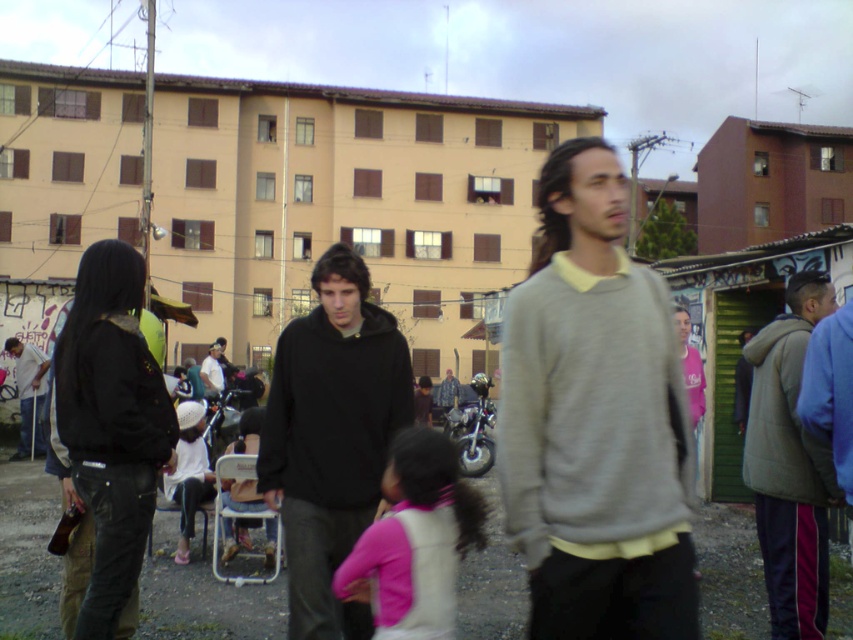
Is black matte hoodie at center thinner than dark gray hoodie at center?

Indeed, black matte hoodie at center has a lesser width compared to dark gray hoodie at center.

Does black matte hoodie at center have a greater height compared to dark gray hoodie at center?

Correct, black matte hoodie at center is much taller as dark gray hoodie at center.

Where is `black matte hoodie at center`? The image size is (853, 640). black matte hoodie at center is located at coordinates (331, 436).

Between gray sweater at center and gray woolen sweater at right, which one has less height?

gray sweater at center

The height and width of the screenshot is (640, 853). What do you see at coordinates (595, 420) in the screenshot?
I see `gray sweater at center` at bounding box center [595, 420].

Who is more distant from viewer, (608, 464) or (790, 515)?

The point (790, 515) is behind.

I want to click on gray sweater at center, so click(595, 420).

Describe the element at coordinates (788, 465) in the screenshot. This screenshot has width=853, height=640. I see `gray woolen sweater at right` at that location.

In the scene shown: Does gray woolen sweater at right appear on the right side of camouflage fabric jacket at center?

Yes, gray woolen sweater at right is to the right of camouflage fabric jacket at center.

The image size is (853, 640). What do you see at coordinates (788, 465) in the screenshot?
I see `gray woolen sweater at right` at bounding box center [788, 465].

The width and height of the screenshot is (853, 640). I want to click on gray woolen sweater at right, so click(788, 465).